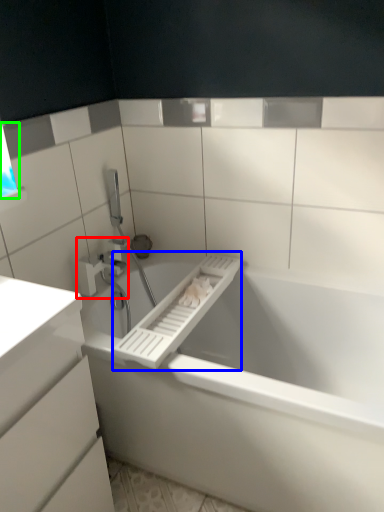
Question: Considering the real-world distances, which object is farthest from tap (highlighted by a red box)? towel bar (highlighted by a blue box) or window (highlighted by a green box)?

Choices:
 (A) towel bar
 (B) window

Answer: (B)